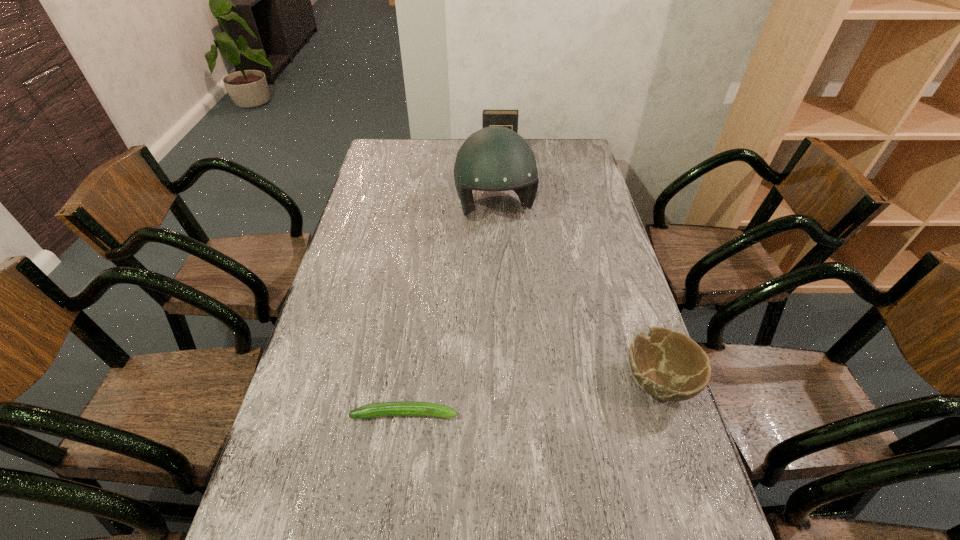
At what (x,y) coordinates should I click in order to perform the action: click on zucchini. Please return your answer as a coordinate pair (x, y). Image resolution: width=960 pixels, height=540 pixels. Looking at the image, I should click on (399, 408).

What are the coordinates of `the rightmost object` in the screenshot? It's located at (667, 364).

This screenshot has width=960, height=540. I want to click on the third tallest object, so click(667, 364).

Find the location of a particular element. Image resolution: width=960 pixels, height=540 pixels. the tallest object is located at coordinates (495, 158).

The width and height of the screenshot is (960, 540). Find the location of `football helmet`. football helmet is located at coordinates (495, 158).

Where is `the farthest object`? The width and height of the screenshot is (960, 540). the farthest object is located at coordinates (505, 118).

You are a GUI agent. You are given a task and a screenshot of the screen. Output one action in this format:
    pyautogui.click(x=<x>, y=<y>)
    Task: Click on the diary
    This screenshot has width=960, height=540.
    Given the screenshot: What is the action you would take?
    pyautogui.click(x=505, y=118)

Locate an element on the screen. The height and width of the screenshot is (540, 960). vacant space located on the front-facing side of the zucchini is located at coordinates (534, 414).

Find the location of a particular element. free space located on the left of the bowl is located at coordinates (601, 381).

Find the location of a particular element. The width and height of the screenshot is (960, 540). vacant area situated 0.150m at the face opening of the tallest object is located at coordinates (513, 267).